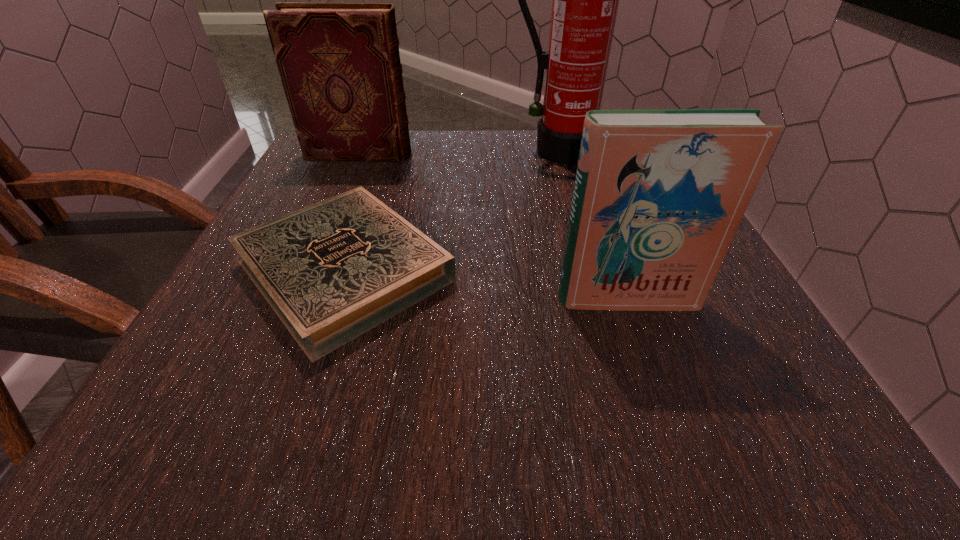
Locate an element on the screen. fire extinguisher situated at the right edge is located at coordinates (585, 0).

You are a GUI agent. You are given a task and a screenshot of the screen. Output one action in this format:
    pyautogui.click(x=<x>, y=<y>)
    Task: Click on the hardback book present at the right edge
    This screenshot has height=540, width=960.
    Given the screenshot: What is the action you would take?
    pyautogui.click(x=659, y=194)

This screenshot has height=540, width=960. Identify the location of object situated at the far left corner. (339, 63).

Identify the location of object positioned at the far right corner. (585, 0).

At what (x,y) coordinates should I click in order to perform the action: click on free region at the far edge of the desktop. Please return your answer as a coordinate pair (x, y). This screenshot has width=960, height=540. Looking at the image, I should click on (473, 147).

Where is `vacant space at the near edge of the desktop`? Image resolution: width=960 pixels, height=540 pixels. vacant space at the near edge of the desktop is located at coordinates (650, 395).

Identify the location of vacant space at the right edge of the desktop. This screenshot has height=540, width=960. (691, 321).

Find the location of a particular element. This screenshot has height=540, width=960. free space at the near right corner of the desktop is located at coordinates (767, 401).

Image resolution: width=960 pixels, height=540 pixels. Identify the location of vacant space that's between the farthest hardback book and the fire extinguisher. (457, 153).

Identify the location of free point between the rightmost hardback book and the farthest hardback book. This screenshot has height=540, width=960. coord(493,227).